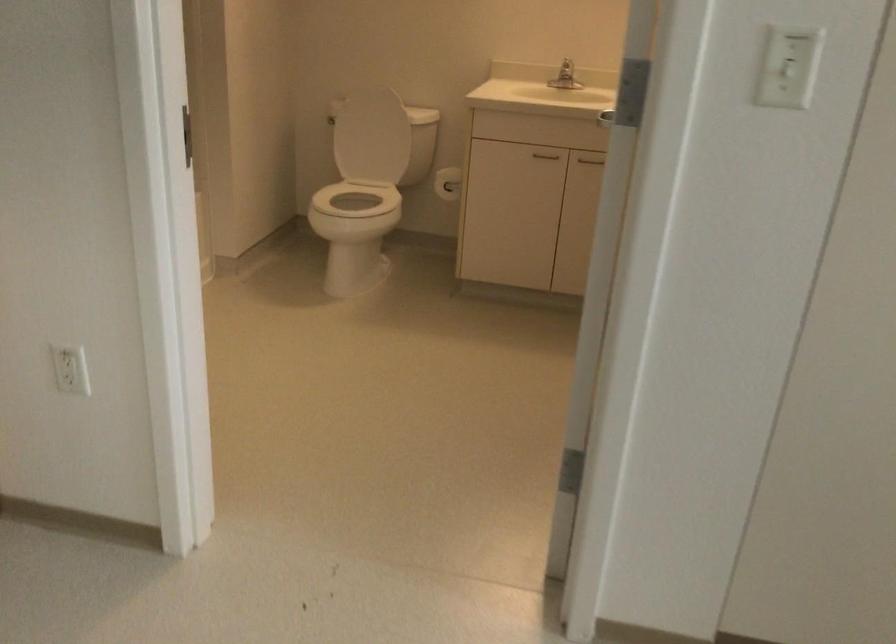
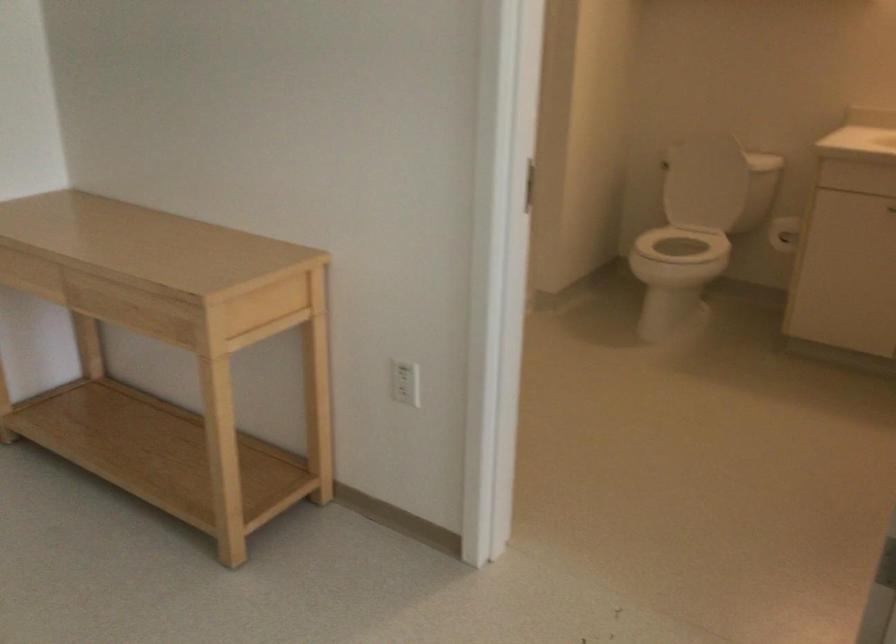
Question: The camera is either moving clockwise (left) or counter-clockwise (right) around the object. The first image is from the beginning of the video and the second image is from the end. Is the camera moving left or right when shooting the video?

Choices:
 (A) Left
 (B) Right

Answer: (B)